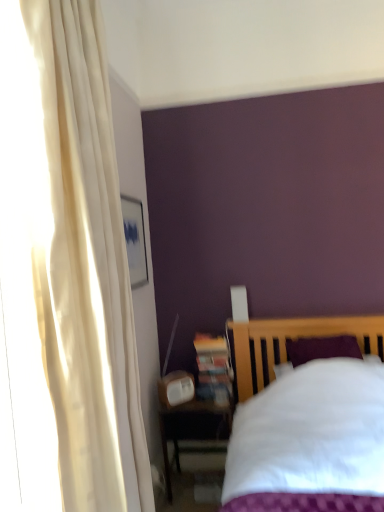
This screenshot has height=512, width=384. What do you see at coordinates (297, 407) in the screenshot?
I see `white cotton bed at lower right` at bounding box center [297, 407].

What is the approximate height of wooden bookshelf at lower center?

wooden bookshelf at lower center is 38.18 centimeters in height.

Where is `wooden bookshelf at lower center`? This screenshot has height=512, width=384. wooden bookshelf at lower center is located at coordinates (213, 361).

Find the location of a particular element. Image resolution: width=384 pixels, height=512 pixels. matte wooden nightstand at lower left is located at coordinates (194, 431).

This screenshot has width=384, height=512. Find the location of `white cotton bed at lower right`. white cotton bed at lower right is located at coordinates (297, 407).

Does matte wooden nightstand at lower left have a greater width compared to white cotton bed at lower right?

No.

Looking at this image, is matte wooden nightstand at lower left looking in the opposite direction of white cotton bed at lower right?

matte wooden nightstand at lower left is not turned away from white cotton bed at lower right.

From the image's perspective, between matte wooden nightstand at lower left and white cotton bed at lower right, which one is located above?

white cotton bed at lower right appears higher in the image.

Are matte wooden nightstand at lower left and white cotton bed at lower right beside each other?

There is a gap between matte wooden nightstand at lower left and white cotton bed at lower right.

Is wooden bookshelf at lower center smaller than matte wooden nightstand at lower left?

Yes.

Which is further, (217, 355) or (188, 441)?

Positioned behind is point (188, 441).

Is wooden bookshelf at lower center not within matte wooden nightstand at lower left?

wooden bookshelf at lower center lies outside matte wooden nightstand at lower left's area.

Does wooden bookshelf at lower center have a lesser width compared to matte wooden nightstand at lower left?

Yes, wooden bookshelf at lower center is thinner than matte wooden nightstand at lower left.

Is matte wooden nightstand at lower left completely or partially outside of wooden bookshelf at lower center?

Yes, matte wooden nightstand at lower left is located beyond the bounds of wooden bookshelf at lower center.

Considering the relative sizes of matte wooden nightstand at lower left and wooden bookshelf at lower center in the image provided, is matte wooden nightstand at lower left shorter than wooden bookshelf at lower center?

Incorrect, the height of matte wooden nightstand at lower left does not fall short of that of wooden bookshelf at lower center.

From the image's perspective, is matte wooden nightstand at lower left positioned above or below wooden bookshelf at lower center?

From the image's perspective, matte wooden nightstand at lower left appears below wooden bookshelf at lower center.

Considering the positions of points (172, 442) and (206, 343), is point (172, 442) farther from camera compared to point (206, 343)?

That is True.

From a real-world perspective, is white cotton bed at lower right under wooden bookshelf at lower center?

Yes, from a real-world perspective, white cotton bed at lower right is below wooden bookshelf at lower center.

Is point (274, 395) behind point (203, 354)?

No, (274, 395) is closer to viewer.

Find the location of a particular element. bookshelf on the left of white cotton bed at lower right is located at coordinates (213, 361).

Would you consider white cotton bed at lower right to be distant from wooden bookshelf at lower center?

white cotton bed at lower right is actually quite close to wooden bookshelf at lower center.

From the image's perspective, relative to matte wooden nightstand at lower left, is white cotton bed at lower right above or below?

white cotton bed at lower right is situated higher than matte wooden nightstand at lower left in the image.

In the scene shown: Can you confirm if white cotton bed at lower right is shorter than matte wooden nightstand at lower left?

In fact, white cotton bed at lower right may be taller than matte wooden nightstand at lower left.

Does point (296, 373) come in front of point (189, 415)?

Yes, point (296, 373) is in front of point (189, 415).

Does white cotton bed at lower right have a larger size compared to matte wooden nightstand at lower left?

Yes.

Is wooden bookshelf at lower center to the right of white cotton bed at lower right from the viewer's perspective?

In fact, wooden bookshelf at lower center is to the left of white cotton bed at lower right.

Measure the distance between wooden bookshelf at lower center and white cotton bed at lower right.

wooden bookshelf at lower center and white cotton bed at lower right are 20.85 inches apart from each other.

Which is less distant, (198,376) or (327,463)?

The point (327,463) is closer.

How different are the orientations of wooden bookshelf at lower center and white cotton bed at lower right in degrees?

The angular difference between wooden bookshelf at lower center and white cotton bed at lower right is 0.353 degrees.

The width and height of the screenshot is (384, 512). Find the location of `nightstand to the left of white cotton bed at lower right`. nightstand to the left of white cotton bed at lower right is located at coordinates (194, 431).

Find the location of a particular element. nightstand located below the wooden bookshelf at lower center (from the image's perspective) is located at coordinates (194, 431).

When comparing their distances from wooden bookshelf at lower center, does matte wooden nightstand at lower left or white cotton bed at lower right seem closer?

matte wooden nightstand at lower left is closer to wooden bookshelf at lower center.

Based on their spatial positions, is wooden bookshelf at lower center or matte wooden nightstand at lower left further from white cotton bed at lower right?

The object further to white cotton bed at lower right is matte wooden nightstand at lower left.

Based on their spatial positions, is white cotton bed at lower right or matte wooden nightstand at lower left closer to wooden bookshelf at lower center?

The object closer to wooden bookshelf at lower center is matte wooden nightstand at lower left.

Looking at the image, which one is located further to matte wooden nightstand at lower left, wooden bookshelf at lower center or white cotton bed at lower right?

Among the two, white cotton bed at lower right is located further to matte wooden nightstand at lower left.

From the image, which object appears to be nearer to matte wooden nightstand at lower left, white cotton bed at lower right or wooden bookshelf at lower center?

wooden bookshelf at lower center lies closer to matte wooden nightstand at lower left than the other object.

Considering their positions, is matte wooden nightstand at lower left positioned closer to white cotton bed at lower right than wooden bookshelf at lower center?

wooden bookshelf at lower center is closer to white cotton bed at lower right.

Locate an element on the screen. This screenshot has height=512, width=384. nightstand between white cotton bed at lower right and wooden bookshelf at lower center along the z-axis is located at coordinates (194, 431).